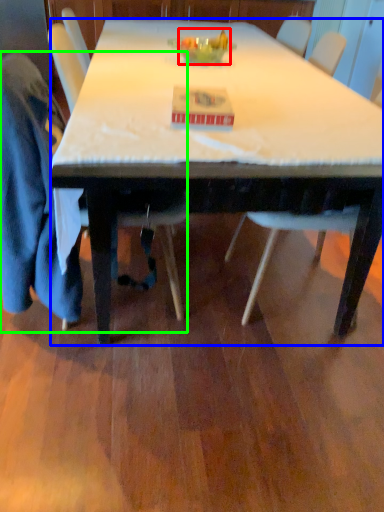
Question: Which object is positioned closest to food (highlighted by a red box)? Select from desk (highlighted by a blue box) and chair (highlighted by a green box).

Choices:
 (A) desk
 (B) chair

Answer: (A)